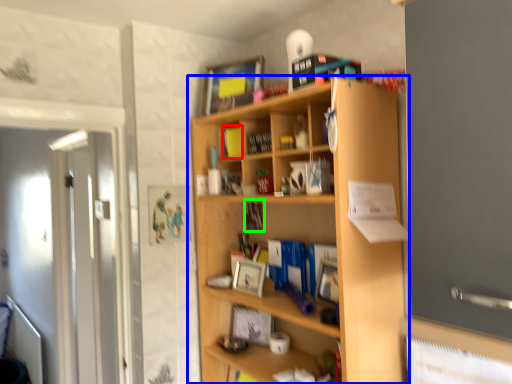
Question: Which is nearer to the book (highlighted by a red box)? shelf (highlighted by a blue box) or book (highlighted by a green box).

Choices:
 (A) shelf
 (B) book

Answer: (B)